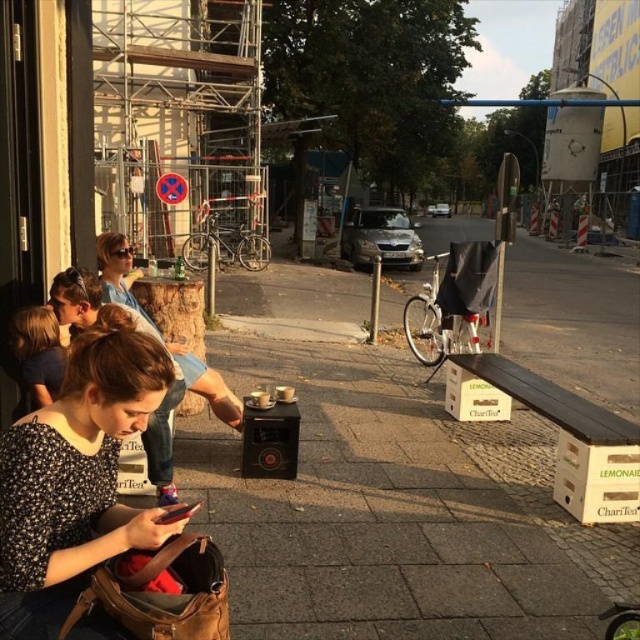
Can you confirm if white cardboard bus stop at lower right is positioned below spotted floral blouse at lower left?

Yes.

Identify the location of white cardboard bus stop at lower right. Image resolution: width=640 pixels, height=640 pixels. (573, 440).

In order to click on white cardboard bus stop at lower right in this screenshot , I will do `click(573, 440)`.

The height and width of the screenshot is (640, 640). In order to click on white cardboard bus stop at lower right in this screenshot , I will do `click(573, 440)`.

Does floral print shirt at center appear under white cardboard bus stop at lower right?

No.

Is floral print shirt at center wider than white cardboard bus stop at lower right?

Incorrect, floral print shirt at center's width does not surpass white cardboard bus stop at lower right's.

Locate an element on the screen. floral print shirt at center is located at coordinates (76, 480).

Where is `floral print shirt at center`? floral print shirt at center is located at coordinates (76, 480).

Does white cardboard bus stop at lower right have a lesser height compared to matte black hair at center?

Correct, white cardboard bus stop at lower right is not as tall as matte black hair at center.

Is point (582, 432) positioned behind point (163, 483)?

Yes.

Between point (588, 445) and point (161, 465), which one is positioned in front?

Point (161, 465) is in front.

At what (x,y) coordinates should I click in order to perform the action: click on white cardboard bus stop at lower right. Please return your answer as a coordinate pair (x, y). This screenshot has width=640, height=640. Looking at the image, I should click on (573, 440).